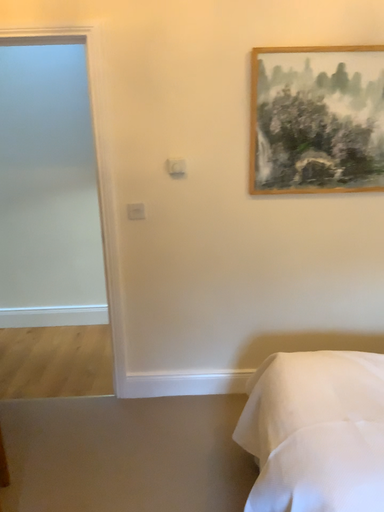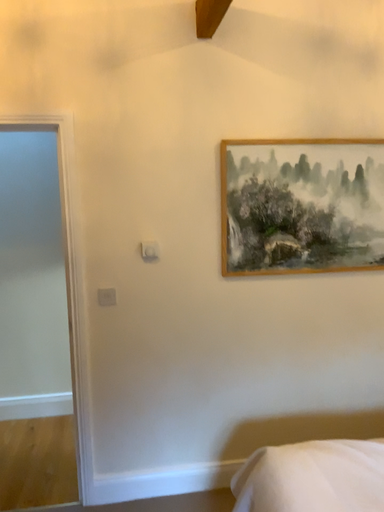
Question: Which way did the camera rotate in the video?

Choices:
 (A) rotated right
 (B) rotated left

Answer: (A)